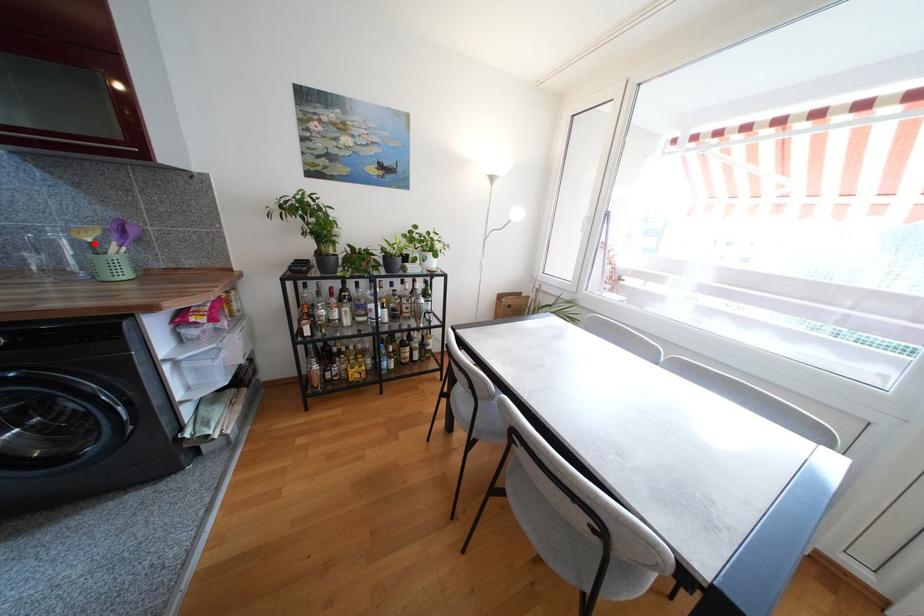
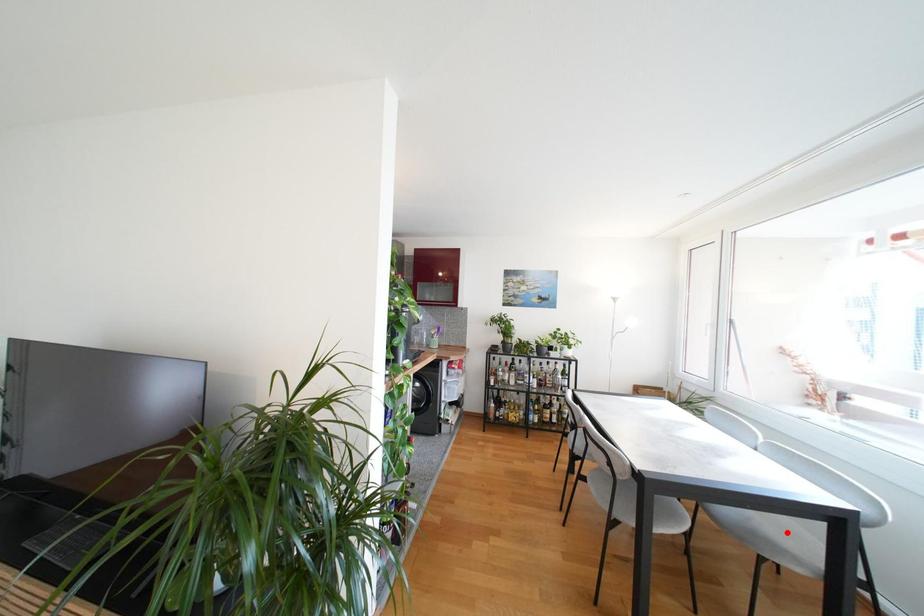
From the picture: I am providing you with two images of the same scene from different viewpoints. A red point is marked on the first image and another point is marked on the second image. Is the red point in image1 aligned with the point shown in image2?

No